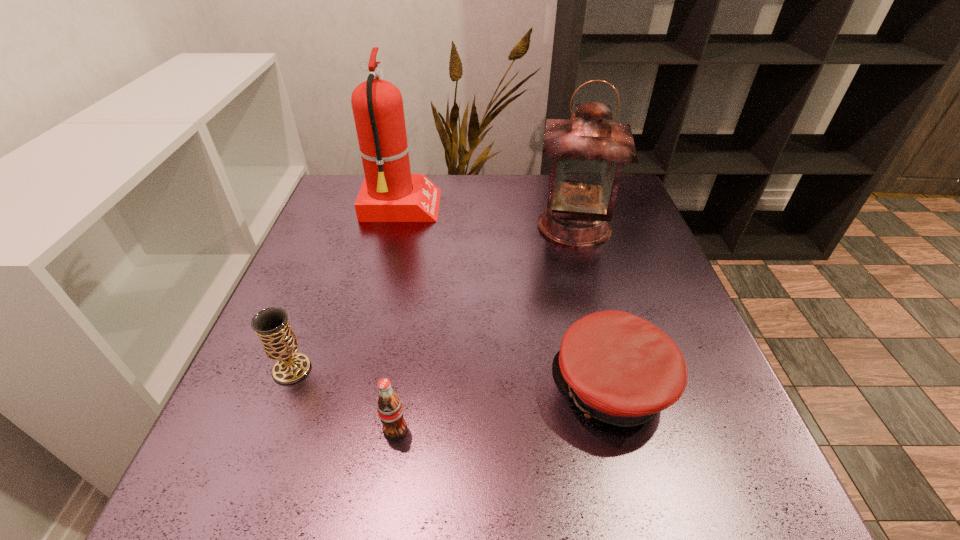
This screenshot has width=960, height=540. What are the coordinates of `blank region between the oil lamp and the shortest object` in the screenshot? It's located at (593, 307).

This screenshot has height=540, width=960. In order to click on vacant area that lies between the oil lamp and the soda in this screenshot , I will do `click(485, 328)`.

You are a GUI agent. You are given a task and a screenshot of the screen. Output one action in this format:
    pyautogui.click(x=<x>, y=<y>)
    Task: Click on the vacant space that is in between the shortest object and the oil lamp
    
    Given the screenshot: What is the action you would take?
    pyautogui.click(x=593, y=307)

You are a GUI agent. You are given a task and a screenshot of the screen. Output one action in this format:
    pyautogui.click(x=<x>, y=<y>)
    Task: Click on the empty space that is in between the cap and the oil lamp
    The height and width of the screenshot is (540, 960).
    Given the screenshot: What is the action you would take?
    pyautogui.click(x=593, y=307)

Where is `free space between the oil lamp and the cap`? free space between the oil lamp and the cap is located at coordinates (593, 307).

Where is `free space between the soda and the chalice`? free space between the soda and the chalice is located at coordinates (344, 400).

In order to click on object that ranks as the closest to the chalice in this screenshot , I will do `click(389, 406)`.

Find the location of a particular element. object that is the fourth closest one to the soda is located at coordinates point(390,193).

Locate an element on the screen. vacant region that satisfies the following two spatial constraints: 1. on the front-facing side of the soda; 2. on the right side of the fire extinguisher is located at coordinates (348, 430).

You are a GUI agent. You are given a task and a screenshot of the screen. Output one action in this format:
    pyautogui.click(x=<x>, y=<y>)
    Task: Click on the vacant region that satisfies the following two spatial constraints: 1. on the front-facing side of the oil lamp; 2. on the right side of the fire extinguisher
    The height and width of the screenshot is (540, 960).
    Given the screenshot: What is the action you would take?
    pyautogui.click(x=396, y=226)